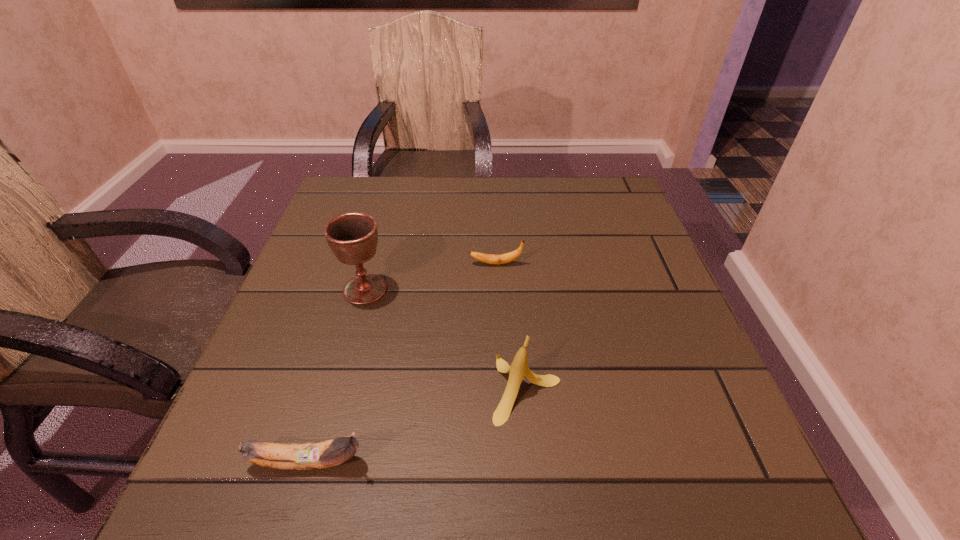
This screenshot has width=960, height=540. I want to click on free point that satisfies the following two spatial constraints: 1. on the peel of the farthest object from the top; 2. on the right side of the second farthest banana, so click(501, 388).

What are the coordinates of `vacant position in the image that satisfies the following two spatial constraints: 1. on the front side of the third farthest object; 2. on the right side of the third nearest object` in the screenshot? It's located at (337, 388).

Locate an element on the screen. vacant region that satisfies the following two spatial constraints: 1. on the front side of the second farthest object; 2. on the left side of the second nearest banana is located at coordinates (337, 388).

The image size is (960, 540). Find the location of `vacant area that satisfies the following two spatial constraints: 1. on the peel of the farthest object from the top; 2. on the back side of the third farthest object`. vacant area that satisfies the following two spatial constraints: 1. on the peel of the farthest object from the top; 2. on the back side of the third farthest object is located at coordinates [501, 388].

Locate an element on the screen. The image size is (960, 540). vacant area that satisfies the following two spatial constraints: 1. on the peel of the shortest banana from the top; 2. on the right side of the second nearest banana is located at coordinates (501, 388).